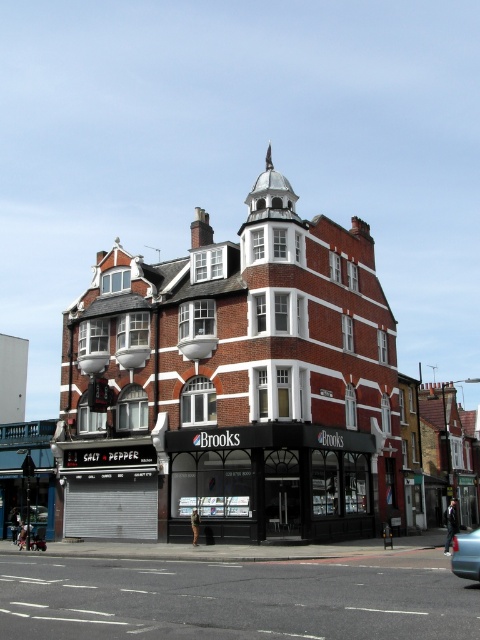
Is red brick building at center wider than matte black storefront at center?

Yes.

Does red brick building at center appear on the left side of matte black storefront at center?

Indeed, red brick building at center is positioned on the left side of matte black storefront at center.

Measure the distance between red brick building at center and camera.

red brick building at center and camera are 168.06 feet apart.

The image size is (480, 640). Find the location of `red brick building at center`. red brick building at center is located at coordinates (233, 385).

Who is more distant from viewer, (100,294) or (472,540)?

The point (100,294) is more distant.

Does red brick building at center have a smaller size compared to metallic blue sedan at lower right?

Incorrect, red brick building at center is not smaller in size than metallic blue sedan at lower right.

The image size is (480, 640). What do you see at coordinates (233, 385) in the screenshot? I see `red brick building at center` at bounding box center [233, 385].

Identify the location of red brick building at center. The image size is (480, 640). (233, 385).

How far apart are red brick building at center and black asphalt road at lower center?

18.57 meters

Does red brick building at center appear under black asphalt road at lower center?

No, red brick building at center is not below black asphalt road at lower center.

Between point (148, 388) and point (39, 593), which one is positioned in front?

Positioned in front is point (39, 593).

At what (x,y) coordinates should I click in order to perform the action: click on red brick building at center. Please return your answer as a coordinate pair (x, y). The width and height of the screenshot is (480, 640). Looking at the image, I should click on (233, 385).